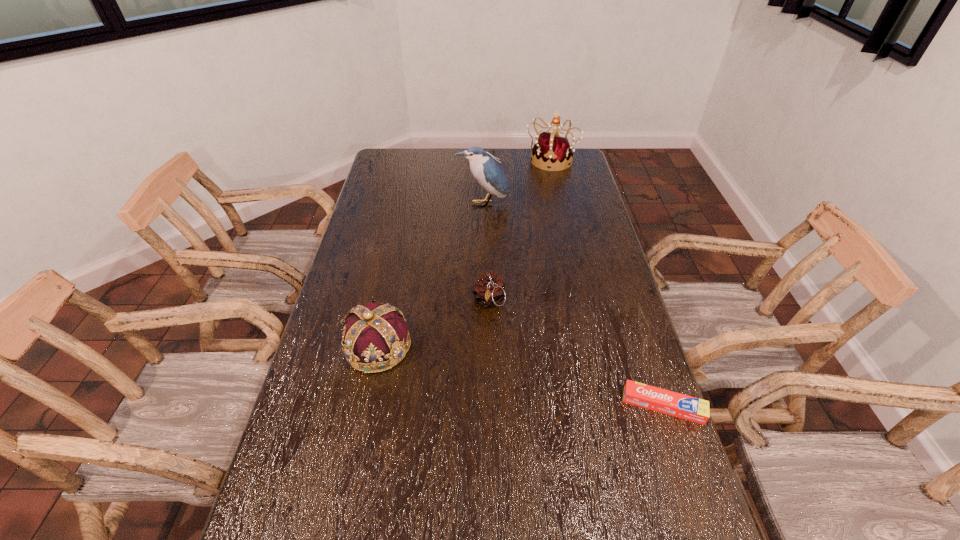
Where is `free space on the desktop that is between the third shortest object and the toothpaste and is positioned with a leaf charm attached to the pinecone`? free space on the desktop that is between the third shortest object and the toothpaste and is positioned with a leaf charm attached to the pinecone is located at coordinates click(x=489, y=369).

The image size is (960, 540). I want to click on free space on the desktop that is between the crown and the toothpaste and is positioned on the front-facing side of the farthest object, so point(482,368).

This screenshot has width=960, height=540. I want to click on free space on the desktop that is between the third shortest object and the toothpaste and is positioned at the tip of the fourth nearest object's beak, so click(500, 372).